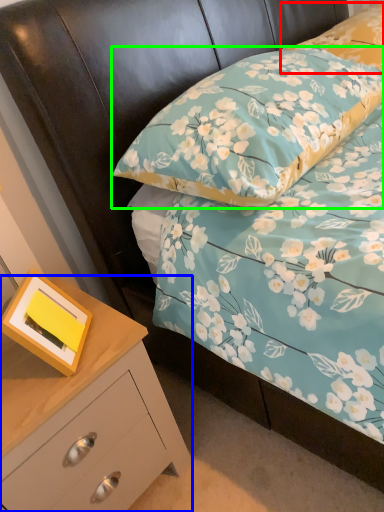
Question: Which object is positioned closest to pillow (highlighted by a red box)? Select from chest of drawers (highlighted by a blue box) and pillow (highlighted by a green box).

Choices:
 (A) chest of drawers
 (B) pillow

Answer: (B)